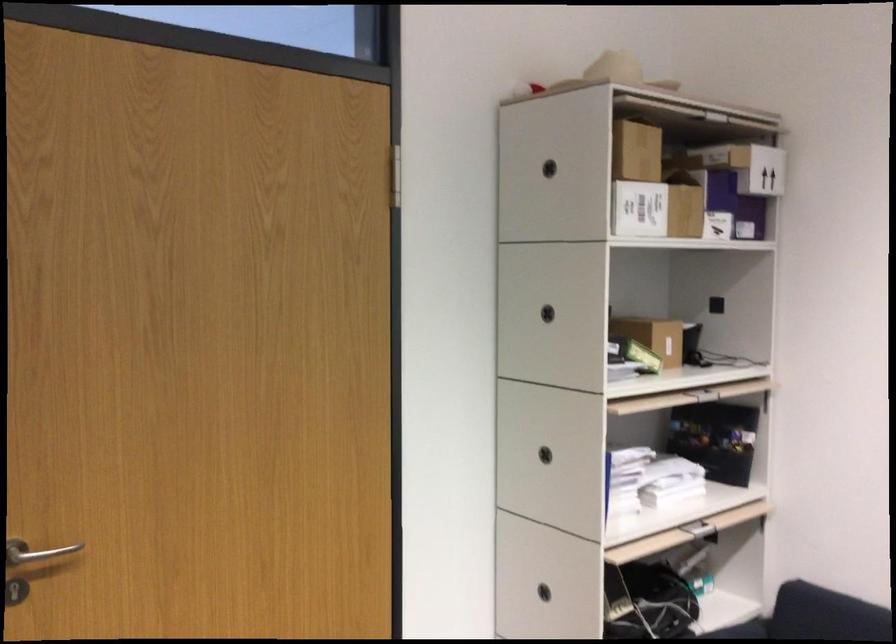
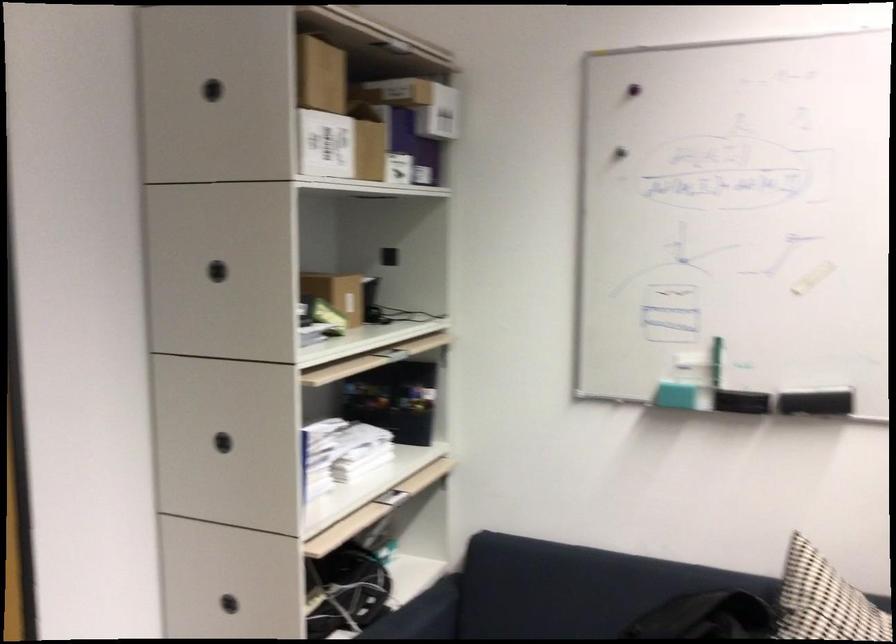
Which direction would the cameraman need to move to produce the second image?

The movement direction of the cameraman is left, forward.